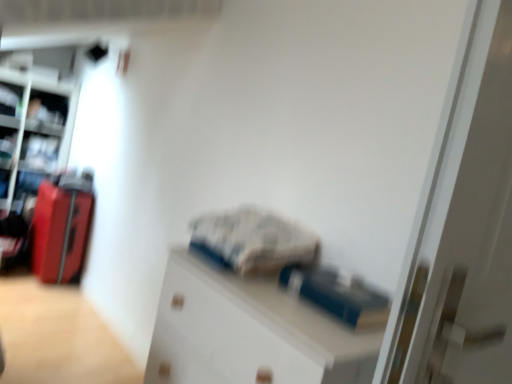
Question: Is matte black shelf at upper left completely or partially inside white glossy door at center?

Choices:
 (A) yes
 (B) no

Answer: (B)

Question: Considering the relative positions of white glossy door at center and matte black shelf at upper left in the image provided, is white glossy door at center to the right of matte black shelf at upper left from the viewer's perspective?

Choices:
 (A) no
 (B) yes

Answer: (B)

Question: Would you say white glossy door at center is outside matte black shelf at upper left?

Choices:
 (A) no
 (B) yes

Answer: (B)

Question: From the image's perspective, is white glossy door at center over matte black shelf at upper left?

Choices:
 (A) yes
 (B) no

Answer: (B)

Question: Is the position of white glossy door at center more distant than that of matte black shelf at upper left?

Choices:
 (A) no
 (B) yes

Answer: (A)

Question: From the image's perspective, relative to white glossy door at center, is white matte cabinet at center above or below?

Choices:
 (A) below
 (B) above

Answer: (A)

Question: Is white matte cabinet at center taller or shorter than white glossy door at center?

Choices:
 (A) short
 (B) tall

Answer: (A)

Question: Is white matte cabinet at center wider or thinner than white glossy door at center?

Choices:
 (A) thin
 (B) wide

Answer: (B)

Question: Relative to white glossy door at center, is white matte cabinet at center in front or behind?

Choices:
 (A) front
 (B) behind

Answer: (B)

Question: Is point pos(65,112) closer or farther from the camera than point pos(229,382)?

Choices:
 (A) farther
 (B) closer

Answer: (A)

Question: Based on their sizes in the image, would you say matte black shelf at upper left is bigger or smaller than white matte cabinet at center?

Choices:
 (A) small
 (B) big

Answer: (A)

Question: Relative to white matte cabinet at center, is matte black shelf at upper left in front or behind?

Choices:
 (A) behind
 (B) front

Answer: (A)

Question: In terms of height, does matte black shelf at upper left look taller or shorter compared to white matte cabinet at center?

Choices:
 (A) short
 (B) tall

Answer: (A)

Question: Is metallic silver bookshelf at left situated inside white matte cabinet at center or outside?

Choices:
 (A) inside
 (B) outside

Answer: (B)

Question: From a real-world perspective, is metallic silver bookshelf at left physically located above or below white matte cabinet at center?

Choices:
 (A) above
 (B) below

Answer: (A)